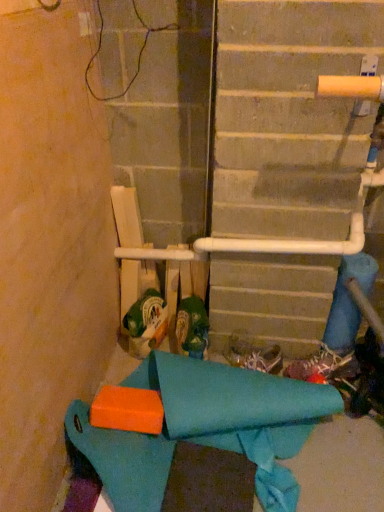
Measure the distance between point (232, 339) and camera.

Point (232, 339) is 1.69 meters away from camera.

The image size is (384, 512). Describe the element at coordinates (319, 364) in the screenshot. I see `white textured shoe at lower right, the third footwear viewed from the left` at that location.

You are a GUI agent. You are given a task and a screenshot of the screen. Output one action in this format:
    pyautogui.click(x=<x>, y=<y>)
    Task: Click on the teal fabric at lower left
    
    Given the screenshot: What is the action you would take?
    pyautogui.click(x=205, y=428)

Can you confirm if teal fabric at lower left is taller than white fabric shoe at center, the 2th footwear from the left?

Indeed, teal fabric at lower left has a greater height compared to white fabric shoe at center, the 2th footwear from the left.

Is teal fabric at lower left wider than white fabric shoe at center, the 2th footwear from the left?

Indeed, teal fabric at lower left has a greater width compared to white fabric shoe at center, the 2th footwear from the left.

How different are the orientations of teal fabric at lower left and white fabric shoe at center, which is counted as the 2th footwear, starting from the right, in degrees?

44.3 degrees.

Does teal fabric at lower left come in front of white fabric shoe at center, the 2th footwear from the left?

Yes, teal fabric at lower left is in front of white fabric shoe at center, the 2th footwear from the left.

Consider the image. From the image's perspective, which is below, white fabric shoe at center, the 2th footwear from the left, or green fabric shoe at center, placed as the third footwear when sorted from right to left?

white fabric shoe at center, the 2th footwear from the left, appears lower in the image.

From the picture: Can you tell me how much white fabric shoe at center, the 2th footwear from the left, and green fabric shoe at center, placed as the third footwear when sorted from right to left, differ in facing direction?

62.7 degrees.

Considering the relative positions of white fabric shoe at center, the 2th footwear from the left, and green fabric shoe at center, marked as the 1th footwear in a left-to-right arrangement, in the image provided, is white fabric shoe at center, the 2th footwear from the left, to the right of green fabric shoe at center, marked as the 1th footwear in a left-to-right arrangement, from the viewer's perspective?

Yes.

Is the surface of white fabric shoe at center, which is counted as the 2th footwear, starting from the right, in direct contact with green fabric shoe at center, placed as the third footwear when sorted from right to left?

They are not placed beside each other.

Considering the positions of objects white textured shoe at lower right, the third footwear viewed from the left, and green fabric shoe at center, placed as the third footwear when sorted from right to left, in the image provided, who is in front, white textured shoe at lower right, the third footwear viewed from the left, or green fabric shoe at center, placed as the third footwear when sorted from right to left,?

green fabric shoe at center, placed as the third footwear when sorted from right to left, is in front.

From the image's perspective, is white textured shoe at lower right, the third footwear viewed from the left, under green fabric shoe at center, marked as the 1th footwear in a left-to-right arrangement?

Yes, from the image's perspective, white textured shoe at lower right, the third footwear viewed from the left, is below green fabric shoe at center, marked as the 1th footwear in a left-to-right arrangement.

What are the coordinates of `the 2nd footwear directly beneath the green fabric shoe at center, placed as the third footwear when sorted from right to left (from a real-world perspective)` in the screenshot? It's located at (319, 364).

Can we say white textured shoe at lower right, the third footwear viewed from the left, lies outside teal fabric at lower left?

Yes, white textured shoe at lower right, the third footwear viewed from the left, is not within teal fabric at lower left.

The height and width of the screenshot is (512, 384). Identify the location of fabric below the white textured shoe at lower right, the 1th footwear when ordered from right to left (from the image's perspective). (205, 428).

From a real-world perspective, who is located higher, white textured shoe at lower right, the 1th footwear when ordered from right to left, or teal fabric at lower left?

From a 3D spatial view, teal fabric at lower left is above.

Between white textured shoe at lower right, the third footwear viewed from the left, and teal fabric at lower left, which one is positioned behind?

white textured shoe at lower right, the third footwear viewed from the left, is further from the camera.

From the image's perspective, is teal fabric at lower left positioned above or below green fabric shoe at center, placed as the third footwear when sorted from right to left?

teal fabric at lower left is situated lower than green fabric shoe at center, placed as the third footwear when sorted from right to left, in the image.

How many degrees apart are the facing directions of teal fabric at lower left and green fabric shoe at center, placed as the third footwear when sorted from right to left?

The angle between the facing direction of teal fabric at lower left and the facing direction of green fabric shoe at center, placed as the third footwear when sorted from right to left, is 18.3 degrees.

Between teal fabric at lower left and green fabric shoe at center, marked as the 1th footwear in a left-to-right arrangement, which one is positioned in front?

teal fabric at lower left is in front.

Is teal fabric at lower left facing towards green fabric shoe at center, placed as the third footwear when sorted from right to left?

No, teal fabric at lower left is not turned towards green fabric shoe at center, placed as the third footwear when sorted from right to left.

From the image's perspective, is white fabric shoe at center, which is counted as the 2th footwear, starting from the right, above or below white textured shoe at lower right, the third footwear viewed from the left?

Clearly, from the image's perspective, white fabric shoe at center, which is counted as the 2th footwear, starting from the right, is above white textured shoe at lower right, the third footwear viewed from the left.

Considering the positions of objects white fabric shoe at center, the 2th footwear from the left, and white textured shoe at lower right, the 1th footwear when ordered from right to left, in the image provided, who is more to the left, white fabric shoe at center, the 2th footwear from the left, or white textured shoe at lower right, the 1th footwear when ordered from right to left,?

From the viewer's perspective, white fabric shoe at center, the 2th footwear from the left, appears more on the left side.

How far apart are white fabric shoe at center, which is counted as the 2th footwear, starting from the right, and white textured shoe at lower right, the 1th footwear when ordered from right to left?

white fabric shoe at center, which is counted as the 2th footwear, starting from the right, and white textured shoe at lower right, the 1th footwear when ordered from right to left, are 5.94 inches apart.

Would you say white fabric shoe at center, the 2th footwear from the left, is outside white textured shoe at lower right, the third footwear viewed from the left?

Absolutely, white fabric shoe at center, the 2th footwear from the left, is external to white textured shoe at lower right, the third footwear viewed from the left.

What's the angular difference between teal fabric at lower left and white textured shoe at lower right, the third footwear viewed from the left,'s facing directions?

They differ by 22.8 degrees in their facing directions.

From a real-world perspective, is teal fabric at lower left positioned above or below white textured shoe at lower right, the third footwear viewed from the left?

teal fabric at lower left is situated higher than white textured shoe at lower right, the third footwear viewed from the left, in the real world.

Is teal fabric at lower left positioned in front of white textured shoe at lower right, the 1th footwear when ordered from right to left?

Yes, it is in front of white textured shoe at lower right, the 1th footwear when ordered from right to left.

Where is `footwear that is the 1st one below the teal fabric at lower left (from a real-world perspective)`? footwear that is the 1st one below the teal fabric at lower left (from a real-world perspective) is located at coordinates (253, 353).

You are a GUI agent. You are given a task and a screenshot of the screen. Output one action in this format:
    pyautogui.click(x=<x>, y=<y>)
    Task: Click on the footwear located above the white fabric shoe at center, the 2th footwear from the left (from a real-world perspective)
    This screenshot has width=384, height=512.
    Given the screenshot: What is the action you would take?
    pyautogui.click(x=192, y=327)

From the picture: Looking at the image, which one is located closer to white fabric shoe at center, the 2th footwear from the left, green fabric shoe at center, marked as the 1th footwear in a left-to-right arrangement, or teal fabric at lower left?

green fabric shoe at center, marked as the 1th footwear in a left-to-right arrangement, is positioned closer to the anchor white fabric shoe at center, the 2th footwear from the left.

From the image, which object appears to be nearer to teal fabric at lower left, white fabric shoe at center, the 2th footwear from the left, or green fabric shoe at center, marked as the 1th footwear in a left-to-right arrangement?

green fabric shoe at center, marked as the 1th footwear in a left-to-right arrangement, lies closer to teal fabric at lower left than the other object.

Looking at the image, which one is located closer to white textured shoe at lower right, the third footwear viewed from the left, teal fabric at lower left or green fabric shoe at center, placed as the third footwear when sorted from right to left?

teal fabric at lower left.

From the image, which object appears to be farther from green fabric shoe at center, placed as the third footwear when sorted from right to left, teal fabric at lower left or white textured shoe at lower right, the 1th footwear when ordered from right to left?

white textured shoe at lower right, the 1th footwear when ordered from right to left, lies further to green fabric shoe at center, placed as the third footwear when sorted from right to left, than the other object.

Estimate the real-world distances between objects in this image. Which object is closer to teal fabric at lower left, green fabric shoe at center, placed as the third footwear when sorted from right to left, or white fabric shoe at center, which is counted as the 2th footwear, starting from the right?

Based on the image, green fabric shoe at center, placed as the third footwear when sorted from right to left, appears to be nearer to teal fabric at lower left.

When comparing their distances from green fabric shoe at center, marked as the 1th footwear in a left-to-right arrangement, does white textured shoe at lower right, the 1th footwear when ordered from right to left, or teal fabric at lower left seem further?

white textured shoe at lower right, the 1th footwear when ordered from right to left.

Estimate the real-world distances between objects in this image. Which object is closer to white textured shoe at lower right, the third footwear viewed from the left, white fabric shoe at center, the 2th footwear from the left, or green fabric shoe at center, marked as the 1th footwear in a left-to-right arrangement?

white fabric shoe at center, the 2th footwear from the left, is closer to white textured shoe at lower right, the third footwear viewed from the left.

Based on their spatial positions, is white textured shoe at lower right, the third footwear viewed from the left, or white fabric shoe at center, the 2th footwear from the left, further from teal fabric at lower left?

white textured shoe at lower right, the third footwear viewed from the left, is positioned further to the anchor teal fabric at lower left.

Where is `footwear between teal fabric at lower left and white fabric shoe at center, which is counted as the 2th footwear, starting from the right, in the front-back direction`? footwear between teal fabric at lower left and white fabric shoe at center, which is counted as the 2th footwear, starting from the right, in the front-back direction is located at coordinates (192, 327).

You are a GUI agent. You are given a task and a screenshot of the screen. Output one action in this format:
    pyautogui.click(x=<x>, y=<y>)
    Task: Click on the footwear between green fabric shoe at center, placed as the third footwear when sorted from right to left, and white textured shoe at lower right, the third footwear viewed from the left, in the horizontal direction
    The height and width of the screenshot is (512, 384).
    Given the screenshot: What is the action you would take?
    pyautogui.click(x=253, y=353)